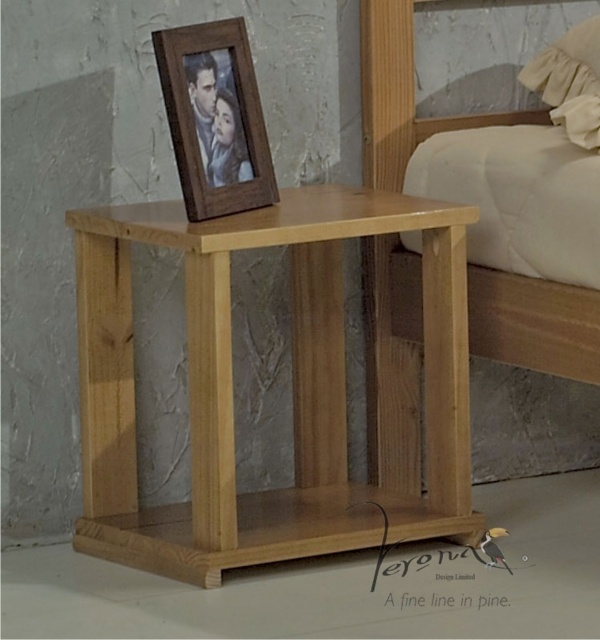
You are standing in the room and want to place a small lamp on the natural wood bed at center. Based on the coordinates provided, where exactly should you place it?

The natural wood bed at center is located at coordinates point (393,358), so you should place the small lamp there.

You are standing in front of the minimalist wooden bedside table. You see the natural wood bed at center and the wooden photo frame at upper center. Which object is positioned higher up?

The wooden photo frame at upper center is positioned higher up than the natural wood bed at center.

You are a photographer adjusting your camera to capture the scene of the minimalist wooden bedside table. You notice two points marked in the image. Which of the two points, point (271, 164) or point (580, 83), is closer to your camera lens?

Point (271, 164) is closer to the camera lens than point (580, 83).